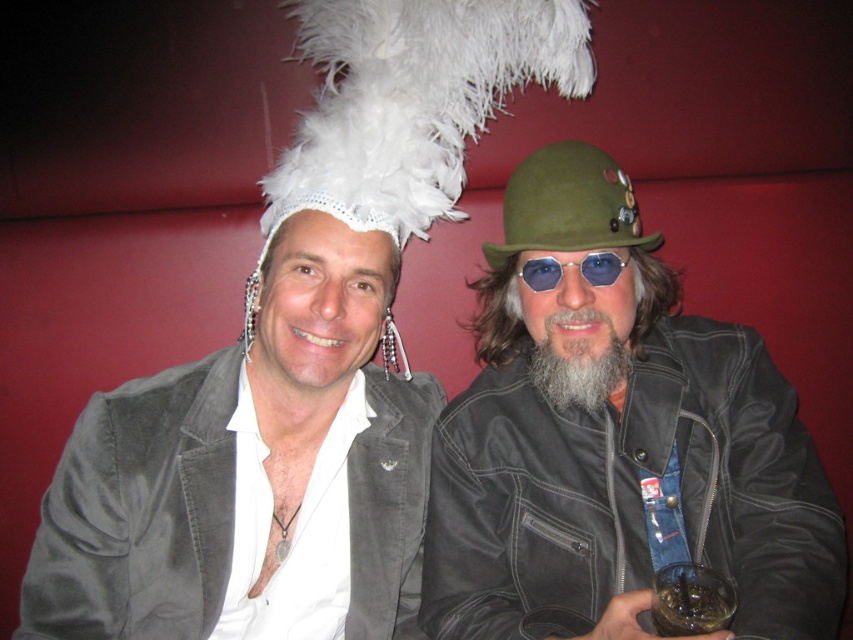
You are a photographer taking a portrait of the two people in the image. You want to ensure that both the suede jacket at center and the graywoollybeard at center are clearly visible in the final shot. Based on their positions, which object should you focus on first to ensure proper depth of field?

The graywoollybeard at center should be focused on first since it is above the suede jacket at center, so focusing on it will ensure the suede jacket at center remains in focus as well due to its lower position.

You are a photographer trying to capture a closeup of the two people in the image. Your camera can only focus on objects within a 5 inch range. Can you focus on both the leather jacket at center and the graywoollybeard at center at the same time?

The distance between the leather jacket at center and the graywoollybeard at center is 4.95 inches, which is within the 5 inch range. Therefore, the camera can focus on both objects simultaneously.

You are standing in front of the image and want to touch the two points mentioned. Which point, point (761,464) or point (605,257), is closer to you?

Point (761,464) is closer to you because it is further to the viewer than point (605,257).